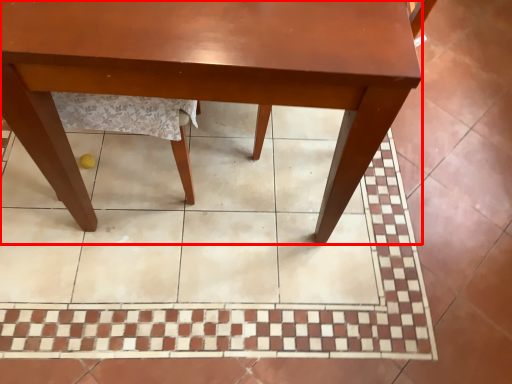
Question: Observing the image, what is the correct spatial positioning of table (annotated by the red box) in reference to ceramic tile?

Choices:
 (A) right
 (B) left

Answer: (B)